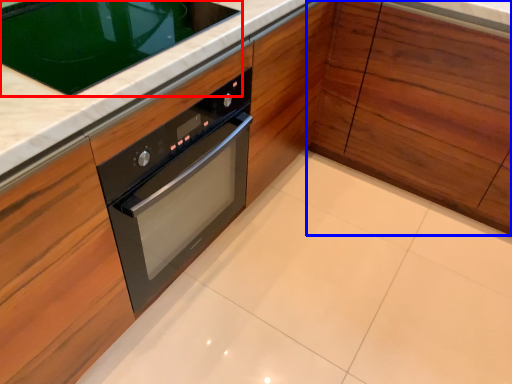
Question: Which object appears farthest to the camera in this image, home appliance (highlighted by a red box) or cabinetry (highlighted by a blue box)?

Choices:
 (A) home appliance
 (B) cabinetry

Answer: (B)